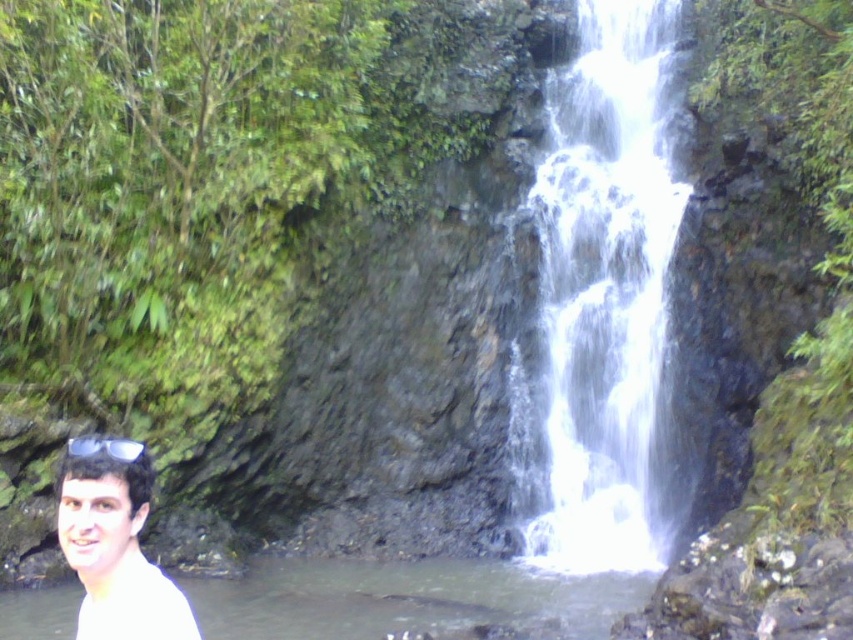
Is white frothy water at center taller than clear water at lower left?

Indeed, white frothy water at center has a greater height compared to clear water at lower left.

Is point (660, 60) more distant than point (598, 579)?

Yes, it is.

The height and width of the screenshot is (640, 853). Find the location of `white frothy water at center`. white frothy water at center is located at coordinates (602, 296).

Is white matte shirt at lower left to the right of clear plastic goggles at lower left from the viewer's perspective?

Correct, you'll find white matte shirt at lower left to the right of clear plastic goggles at lower left.

Who is more distant from viewer, (108, 552) or (128, 449)?

The point (108, 552) is behind.

This screenshot has width=853, height=640. I want to click on white matte shirt at lower left, so click(115, 544).

Is point (375, 605) behind point (173, 628)?

Yes, point (375, 605) is farther from viewer.

Which is behind, point (74, 595) or point (144, 616)?

Positioned behind is point (74, 595).

The width and height of the screenshot is (853, 640). Identify the location of clear water at lower left. (405, 598).